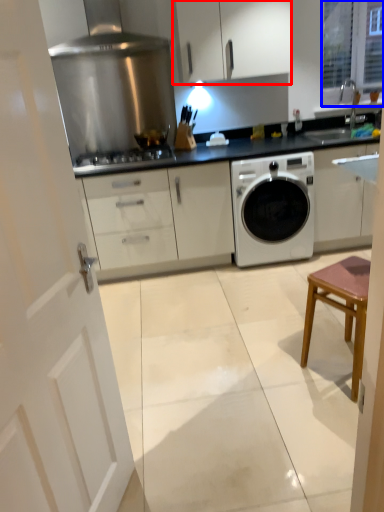
Question: Which of the following is the farthest to the observer, cabinetry (highlighted by a red box) or window (highlighted by a blue box)?

Choices:
 (A) cabinetry
 (B) window

Answer: (B)